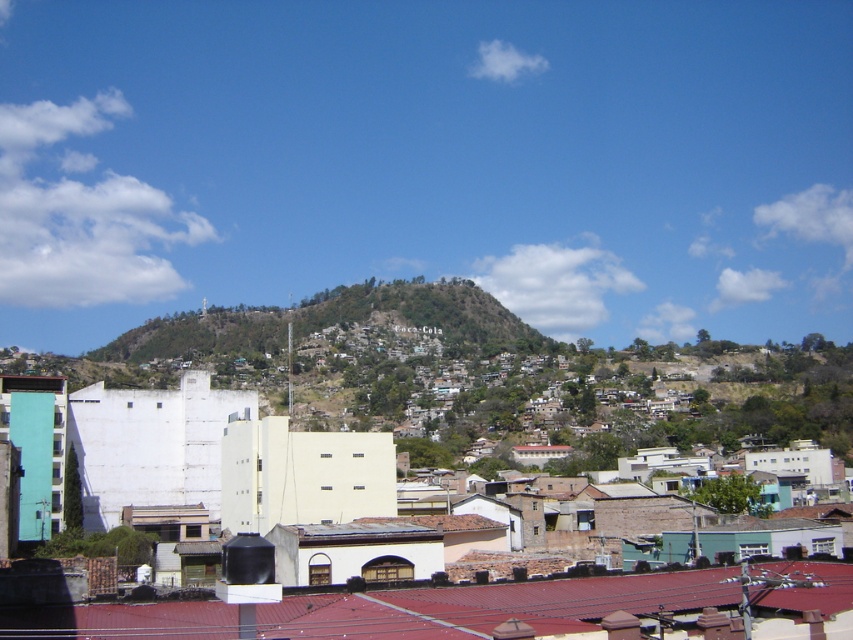
Is white matte building at center closer to the viewer compared to green grassy hillside at center?

Yes, it is.

Is white matte building at center to the right of green grassy hillside at center from the viewer's perspective?

Correct, you'll find white matte building at center to the right of green grassy hillside at center.

Between point (548, 589) and point (476, 337), which one is positioned in front?

Point (548, 589) is in front.

At what (x,y) coordinates should I click in order to perform the action: click on white matte building at center. Please return your answer as a coordinate pair (x, y). The height and width of the screenshot is (640, 853). Looking at the image, I should click on (486, 589).